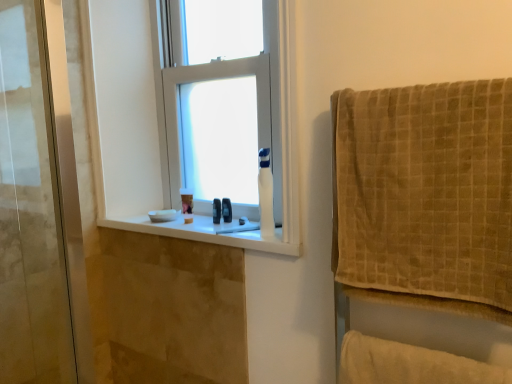
Question: Does white glossy toilet paper at center have a smaller size compared to black rubber ring at window?

Choices:
 (A) yes
 (B) no

Answer: (B)

Question: Can you confirm if white glossy toilet paper at center is taller than black rubber ring at window?

Choices:
 (A) no
 (B) yes

Answer: (B)

Question: Is black rubber ring at window surrounded by white glossy toilet paper at center?

Choices:
 (A) no
 (B) yes

Answer: (A)

Question: Can we say white glossy toilet paper at center lies outside black rubber ring at window?

Choices:
 (A) yes
 (B) no

Answer: (A)

Question: Is white glossy toilet paper at center aimed at black rubber ring at window?

Choices:
 (A) yes
 (B) no

Answer: (B)

Question: In the image, is beige soft towel at lower right positioned in front of or behind beige textured towel at right?

Choices:
 (A) front
 (B) behind

Answer: (B)

Question: Looking at the image, does beige soft towel at lower right seem bigger or smaller compared to beige textured towel at right?

Choices:
 (A) small
 (B) big

Answer: (A)

Question: Is beige soft towel at lower right inside the boundaries of beige textured towel at right, or outside?

Choices:
 (A) outside
 (B) inside

Answer: (A)

Question: From the image's perspective, is beige soft towel at lower right located above or below beige textured towel at right?

Choices:
 (A) above
 (B) below

Answer: (B)

Question: Is point (134, 221) closer or farther from the camera than point (266, 173)?

Choices:
 (A) closer
 (B) farther

Answer: (B)

Question: Considering the relative positions of white glossy window sill at center and white glossy toilet paper at center in the image provided, is white glossy window sill at center to the left or to the right of white glossy toilet paper at center?

Choices:
 (A) left
 (B) right

Answer: (A)

Question: Is white glossy window sill at center bigger or smaller than white glossy toilet paper at center?

Choices:
 (A) small
 (B) big

Answer: (B)

Question: From a real-world perspective, is white glossy window sill at center positioned above or below white glossy toilet paper at center?

Choices:
 (A) above
 (B) below

Answer: (B)

Question: From a real-world perspective, is beige textured towel at right physically located above or below white plastic window at center?

Choices:
 (A) above
 (B) below

Answer: (B)

Question: Is beige textured towel at right wider or thinner than white plastic window at center?

Choices:
 (A) wide
 (B) thin

Answer: (A)